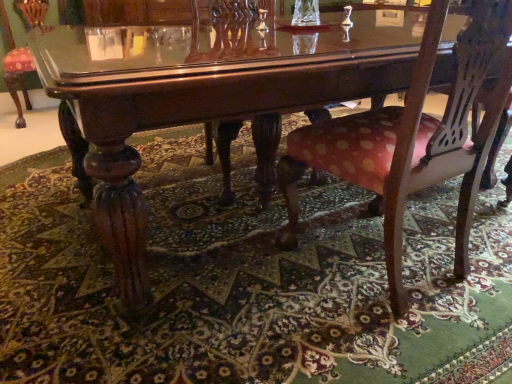
Question: Relative to carpeted floor at center, is polka dot fabric chair at center in front or behind?

Choices:
 (A) behind
 (B) front

Answer: (A)

Question: In terms of size, does polka dot fabric chair at center appear bigger or smaller than carpeted floor at center?

Choices:
 (A) big
 (B) small

Answer: (B)

Question: Is polka dot fabric chair at center to the left or to the right of carpeted floor at center in the image?

Choices:
 (A) right
 (B) left

Answer: (A)

Question: Considering the positions of carpeted floor at center and polka dot fabric chair at center in the image, is carpeted floor at center wider or thinner than polka dot fabric chair at center?

Choices:
 (A) wide
 (B) thin

Answer: (A)

Question: Is carpeted floor at center inside or outside of polka dot fabric chair at center?

Choices:
 (A) inside
 (B) outside

Answer: (B)

Question: Is carpeted floor at center taller or shorter than polka dot fabric chair at center?

Choices:
 (A) tall
 (B) short

Answer: (B)

Question: Visually, is carpeted floor at center positioned to the left or to the right of polka dot fabric chair at center?

Choices:
 (A) right
 (B) left

Answer: (B)